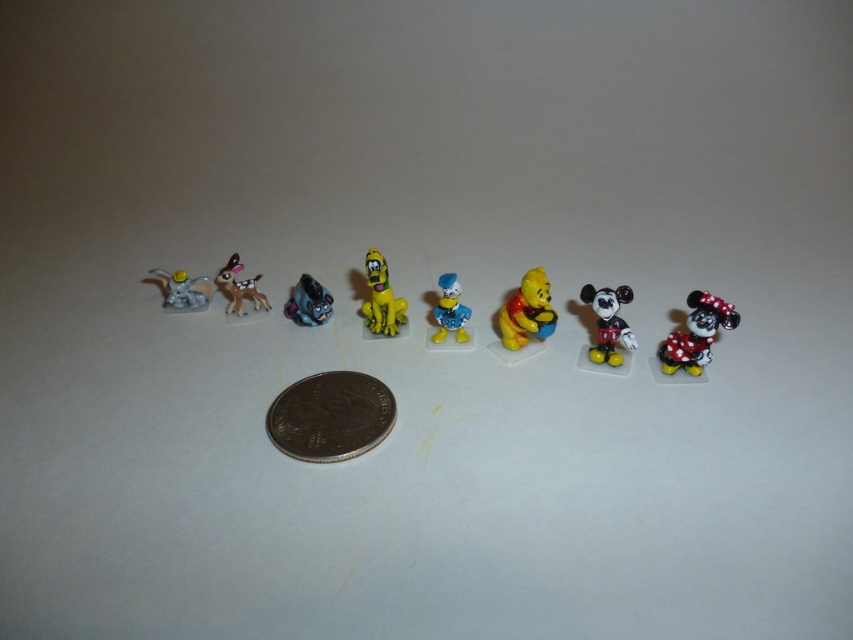
You are an art curator arranging a display. You need to place a new sculpture exactly between the blue glossy donald duck at center and the brushed metal elephant at left. Based on their positions, where should the new sculpture be placed?

The new sculpture should be placed between the blue glossy donald duck at center and the brushed metal elephant at left, positioned exactly halfway between them since the blue glossy donald duck at center is to the right of the brushed metal elephant at left.

You are a toy collector who wants to know if the shiny plastic minnie mouse at right will fit in a display case that can only accommodate items narrower than the yellow matte winnie the pooh at center. Based on the scene, can it fit?

The shiny plastic minnie mouse at right is wider than the yellow matte winnie the pooh at center, so it will not fit in the display case designed for items narrower than the yellow matte winnie the pooh at center.

You have a bronze metallic coin at center and a metallic blue robot at center in front of you. Which object is wider according to the description?

The bronze metallic coin at center might be wider than metallic blue robot at center according to the description.